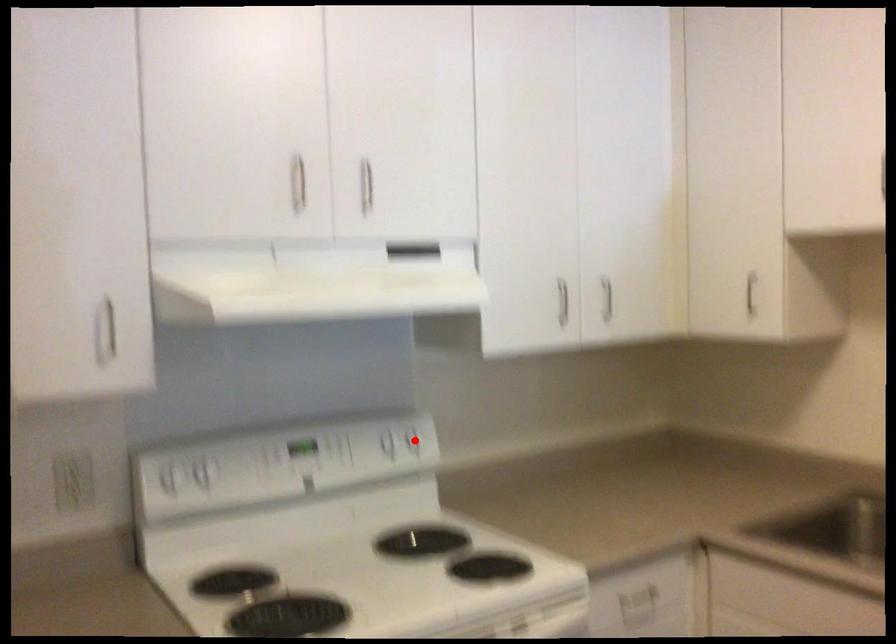
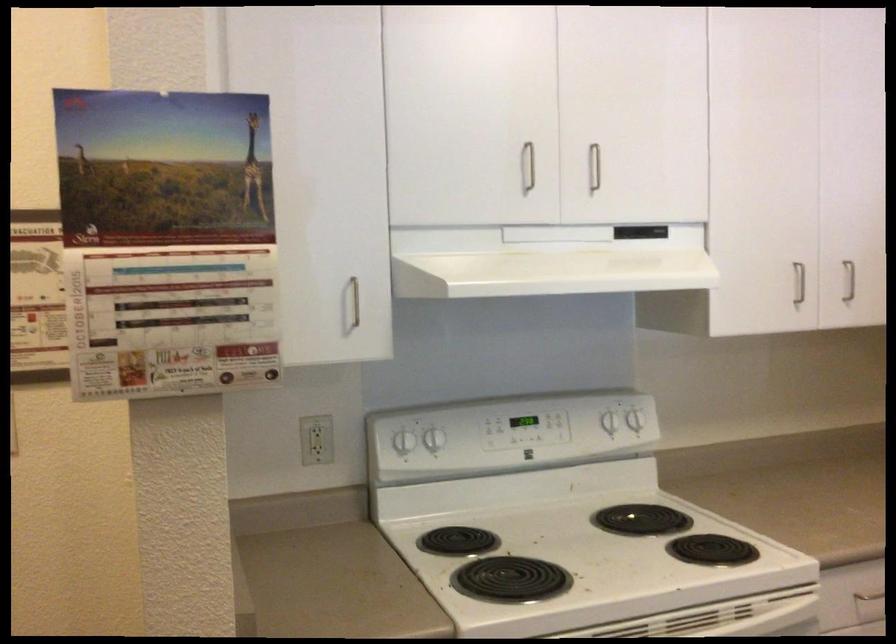
Where in the second image is the point corresponding to the highlighted location from the first image?

(634, 420)